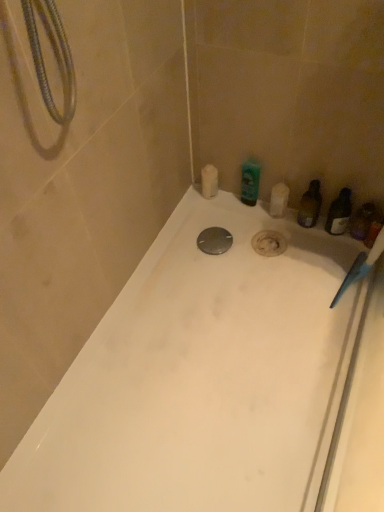
Question: Could you tell me if green glossy bottle at upper right, the second toiletry viewed from the left, is turned towards white matte soap bar at upper center, the fourth toiletry positioned from the right?

Choices:
 (A) yes
 (B) no

Answer: (B)

Question: Is green glossy bottle at upper right, acting as the 3th toiletry starting from the right, to the right of white matte soap bar at upper center, which appears as the first toiletry when viewed from the left, from the viewer's perspective?

Choices:
 (A) yes
 (B) no

Answer: (A)

Question: From a real-world perspective, is green glossy bottle at upper right, acting as the 3th toiletry starting from the right, over white matte soap bar at upper center, the fourth toiletry positioned from the right?

Choices:
 (A) no
 (B) yes

Answer: (B)

Question: Is green glossy bottle at upper right, acting as the 3th toiletry starting from the right, behind white matte soap bar at upper center, the fourth toiletry positioned from the right?

Choices:
 (A) no
 (B) yes

Answer: (A)

Question: Is green glossy bottle at upper right, the second toiletry viewed from the left, to the left of white matte soap bar at upper center, the fourth toiletry positioned from the right, from the viewer's perspective?

Choices:
 (A) yes
 (B) no

Answer: (B)

Question: Which is correct: metallic silver drain at center is inside white matte soap bar at upper center, the fourth toiletry positioned from the right, or outside of it?

Choices:
 (A) inside
 (B) outside

Answer: (B)

Question: Considering the positions of metallic silver drain at center and white matte soap bar at upper center, which appears as the first toiletry when viewed from the left, in the image, is metallic silver drain at center bigger or smaller than white matte soap bar at upper center, which appears as the first toiletry when viewed from the left,?

Choices:
 (A) small
 (B) big

Answer: (A)

Question: Is point (215, 230) closer or farther from the camera than point (205, 166)?

Choices:
 (A) closer
 (B) farther

Answer: (A)

Question: From their relative heights in the image, would you say metallic silver drain at center is taller or shorter than white matte soap bar at upper center, which appears as the first toiletry when viewed from the left?

Choices:
 (A) short
 (B) tall

Answer: (A)

Question: Is translucent plastic bottle at right, placed as the 1th toiletry when sorted from right to left, taller or shorter than white glossy bathtub at center?

Choices:
 (A) short
 (B) tall

Answer: (B)

Question: Is translucent plastic bottle at right, placed as the 1th toiletry when sorted from right to left, inside the boundaries of white glossy bathtub at center, or outside?

Choices:
 (A) inside
 (B) outside

Answer: (B)

Question: Is translucent plastic bottle at right, positioned as the 4th toiletry in left-to-right order, to the left or to the right of white glossy bathtub at center in the image?

Choices:
 (A) left
 (B) right

Answer: (B)

Question: From a real-world perspective, is translucent plastic bottle at right, positioned as the 4th toiletry in left-to-right order, above or below white glossy bathtub at center?

Choices:
 (A) above
 (B) below

Answer: (A)

Question: From a real-world perspective, relative to green glossy bottle at upper right, acting as the 3th toiletry starting from the right, is white matte soap bar at upper center, which appears as the first toiletry when viewed from the left, vertically above or below?

Choices:
 (A) above
 (B) below

Answer: (B)

Question: In terms of size, does white matte soap bar at upper center, the fourth toiletry positioned from the right, appear bigger or smaller than green glossy bottle at upper right, the second toiletry viewed from the left?

Choices:
 (A) big
 (B) small

Answer: (B)